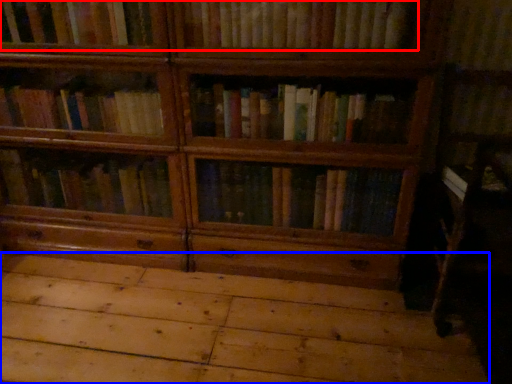
Question: Which object is further to the camera taking this photo, book (highlighted by a red box) or plywood (highlighted by a blue box)?

Choices:
 (A) book
 (B) plywood

Answer: (A)